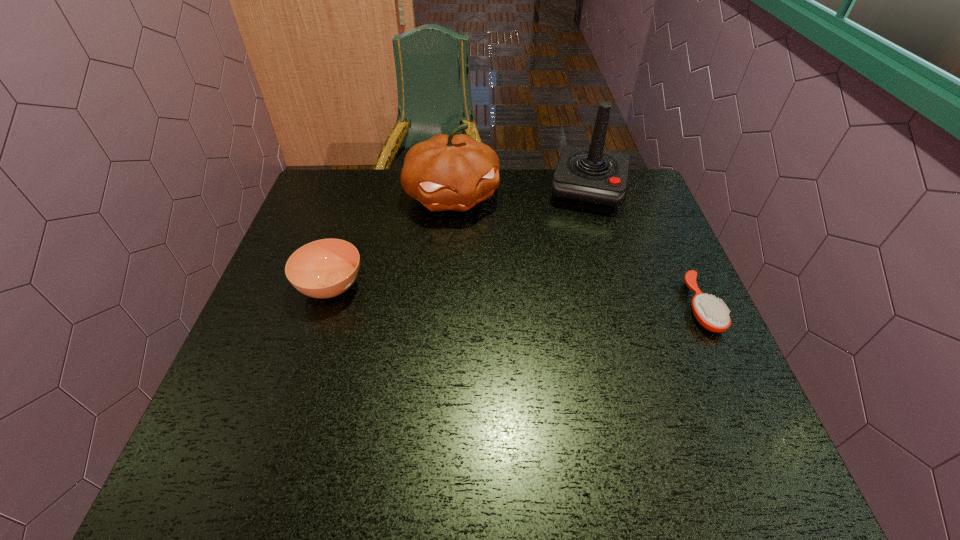
This screenshot has height=540, width=960. I want to click on the second shortest object, so click(325, 268).

Where is `the leftmost object`? This screenshot has height=540, width=960. the leftmost object is located at coordinates (325, 268).

Locate an element on the screen. hairbrush is located at coordinates (710, 313).

Where is `the rightmost object`? the rightmost object is located at coordinates (710, 313).

Where is `the second object from left to right`? the second object from left to right is located at coordinates (454, 172).

Locate an element on the screen. This screenshot has width=960, height=540. the second tallest object is located at coordinates (454, 172).

I want to click on the tallest object, so click(x=593, y=178).

At what (x,y) coordinates should I click in order to perform the action: click on the third object from left to right. Please return your answer as a coordinate pair (x, y). The image size is (960, 540). Looking at the image, I should click on (593, 178).

The height and width of the screenshot is (540, 960). I want to click on free region located on the right of the leftmost object, so click(479, 286).

The image size is (960, 540). Find the location of `vacant position located on the front of the shortest object`. vacant position located on the front of the shortest object is located at coordinates (732, 377).